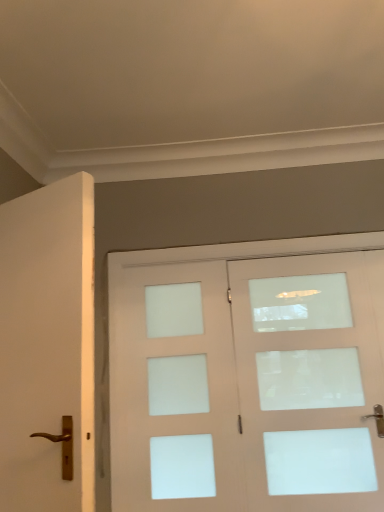
Question: Can you confirm if white matte door at left, arranged as the first door when viewed from the left, is taller than matte white door at center, acting as the first door starting from the back?

Choices:
 (A) yes
 (B) no

Answer: (B)

Question: From the image's perspective, is white matte door at left, acting as the first door starting from the front, above matte white door at center, the 2th door positioned from the left?

Choices:
 (A) no
 (B) yes

Answer: (B)

Question: Is white matte door at left, which is the second door in right-to-left order, not inside matte white door at center, acting as the first door starting from the back?

Choices:
 (A) no
 (B) yes

Answer: (B)

Question: Is white matte door at left, which ranks as the second door in back-to-front order, facing towards matte white door at center, which is counted as the 1th door, starting from the right?

Choices:
 (A) no
 (B) yes

Answer: (B)

Question: Are white matte door at left, arranged as the first door when viewed from the left, and matte white door at center, which is the second door from front to back, making contact?

Choices:
 (A) no
 (B) yes

Answer: (A)

Question: Considering the positions of white frosted glass screen door at center and white matte door at left, arranged as the first door when viewed from the left, in the image, is white frosted glass screen door at center bigger or smaller than white matte door at left, arranged as the first door when viewed from the left,?

Choices:
 (A) big
 (B) small

Answer: (B)

Question: From the image's perspective, relative to white matte door at left, acting as the first door starting from the front, is white frosted glass screen door at center above or below?

Choices:
 (A) below
 (B) above

Answer: (A)

Question: Relative to white matte door at left, which is the second door in right-to-left order, is white frosted glass screen door at center in front or behind?

Choices:
 (A) behind
 (B) front

Answer: (A)

Question: Is white frosted glass screen door at center wider or thinner than white matte door at left, which ranks as the second door in back-to-front order?

Choices:
 (A) wide
 (B) thin

Answer: (B)

Question: Is white matte door at left, acting as the first door starting from the front, in front of or behind matte white door at center, which is the second door from front to back, in the image?

Choices:
 (A) behind
 (B) front

Answer: (B)

Question: Would you say white matte door at left, arranged as the first door when viewed from the left, is to the left or to the right of matte white door at center, which is the second door from front to back, in the picture?

Choices:
 (A) right
 (B) left

Answer: (B)

Question: Considering the positions of white matte door at left, acting as the first door starting from the front, and matte white door at center, the 2th door positioned from the left, in the image, is white matte door at left, acting as the first door starting from the front, wider or thinner than matte white door at center, the 2th door positioned from the left,?

Choices:
 (A) wide
 (B) thin

Answer: (A)

Question: From their relative heights in the image, would you say white matte door at left, acting as the first door starting from the front, is taller or shorter than matte white door at center, which is the second door from front to back?

Choices:
 (A) short
 (B) tall

Answer: (A)

Question: In the image, is white matte door at left, acting as the first door starting from the front, positioned in front of or behind white frosted glass screen door at center?

Choices:
 (A) front
 (B) behind

Answer: (A)

Question: In the image, is white matte door at left, which is the second door in right-to-left order, on the left side or the right side of white frosted glass screen door at center?

Choices:
 (A) right
 (B) left

Answer: (B)